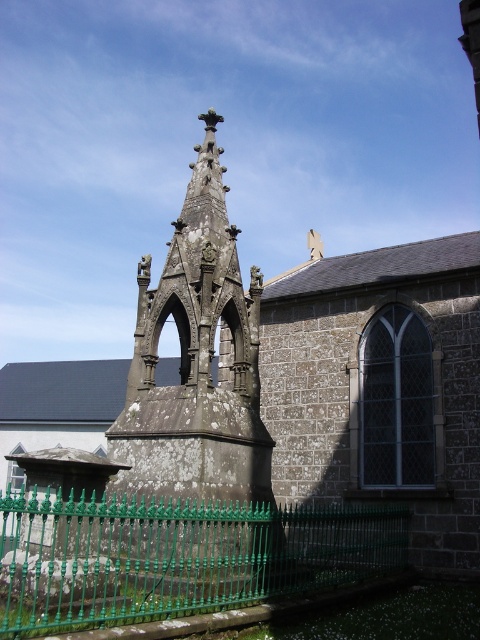
Question: Is rough stone tower at center to the left of green wrought iron fence at lower center from the viewer's perspective?

Choices:
 (A) no
 (B) yes

Answer: (A)

Question: Is rough stone tower at center below green wrought iron fence at lower center?

Choices:
 (A) yes
 (B) no

Answer: (B)

Question: Does rough stone tower at center appear on the left side of green wrought iron fence at lower center?

Choices:
 (A) yes
 (B) no

Answer: (B)

Question: Among these points, which one is nearest to the camera?

Choices:
 (A) (244, 524)
 (B) (37, 625)

Answer: (B)

Question: Which object is farther from the camera taking this photo?

Choices:
 (A) rough stone tower at center
 (B) green wrought iron fence at lower center

Answer: (A)